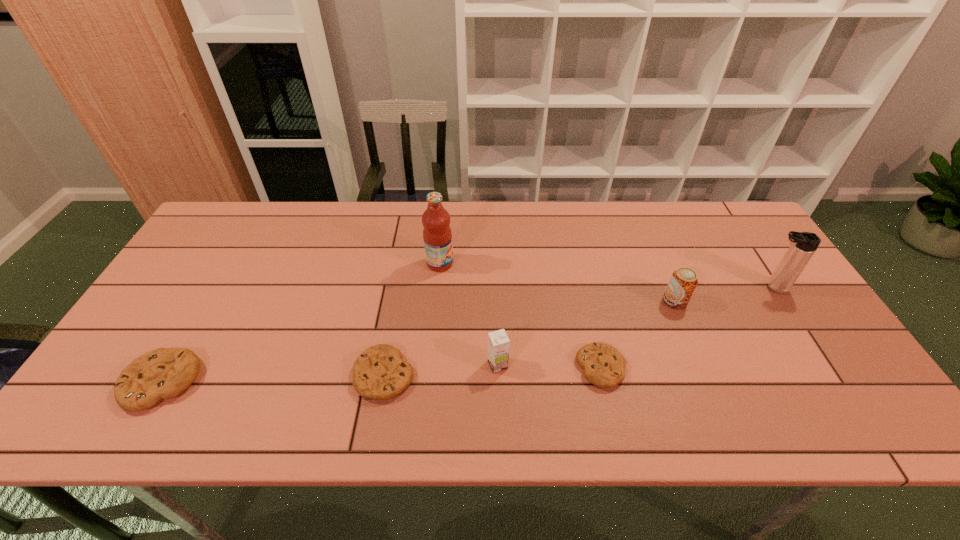
You are a GUI agent. You are given a task and a screenshot of the screen. Output one action in this format:
    pyautogui.click(x=<x>, y=<y>)
    Task: Click on the cookie that is the closest to the beer can
    Image resolution: width=960 pixels, height=540 pixels.
    Given the screenshot: What is the action you would take?
    pyautogui.click(x=603, y=365)

This screenshot has height=540, width=960. Find the location of `free location that satisfies the following two spatial constraints: 1. on the front label of the tallest object; 2. on the back side of the fourth object from left to right`. free location that satisfies the following two spatial constraints: 1. on the front label of the tallest object; 2. on the back side of the fourth object from left to right is located at coordinates (430, 365).

The image size is (960, 540). What are the coordinates of `blank area in the image that satisfies the following two spatial constraints: 1. on the front label of the fruit juice; 2. on the back side of the shortest object` in the screenshot? It's located at (430, 368).

You are a GUI agent. You are given a task and a screenshot of the screen. Output one action in this format:
    pyautogui.click(x=<x>, y=<y>)
    Task: Click on the free space that satisfies the following two spatial constraints: 1. on the front label of the shortest cookie; 2. on the left side of the farthest object
    The width and height of the screenshot is (960, 540).
    Given the screenshot: What is the action you would take?
    pyautogui.click(x=430, y=368)

Identify the location of vacant point that satisfies the following two spatial constraints: 1. on the front label of the shortest cookie; 2. on the right side of the farthest object. Image resolution: width=960 pixels, height=540 pixels. (430, 368).

Where is `vacant space that satisfies the following two spatial constraints: 1. on the front label of the fruit juice; 2. on the back side of the sixth object from left to right`? The height and width of the screenshot is (540, 960). vacant space that satisfies the following two spatial constraints: 1. on the front label of the fruit juice; 2. on the back side of the sixth object from left to right is located at coordinates (436, 301).

Locate an element on the screen. This screenshot has width=960, height=540. vacant space that satisfies the following two spatial constraints: 1. on the back side of the second object from right to left; 2. on the front label of the fruit juice is located at coordinates (659, 264).

Locate an element on the screen. This screenshot has height=540, width=960. free space that satisfies the following two spatial constraints: 1. on the front label of the beer can; 2. on the left side of the tallest object is located at coordinates (436, 301).

This screenshot has width=960, height=540. Find the location of `free point that satisfies the following two spatial constraints: 1. on the front label of the shortest object; 2. on the left side of the fruit juice`. free point that satisfies the following two spatial constraints: 1. on the front label of the shortest object; 2. on the left side of the fruit juice is located at coordinates (430, 368).